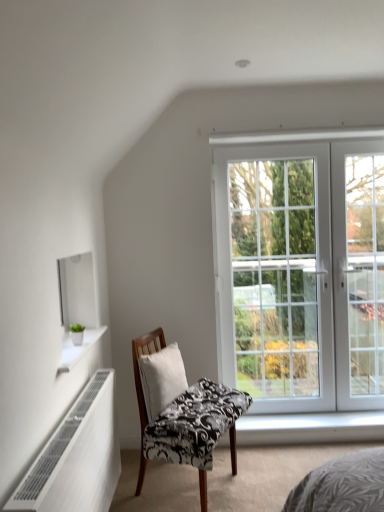
Question: Would you say white glass door at right is part of black and white patterned chair at center's contents?

Choices:
 (A) no
 (B) yes

Answer: (A)

Question: Are black and white patterned chair at center and white glass door at right making contact?

Choices:
 (A) yes
 (B) no

Answer: (B)

Question: Is black and white patterned chair at center wider than white glass door at right?

Choices:
 (A) no
 (B) yes

Answer: (B)

Question: Can you confirm if black and white patterned chair at center is shorter than white glass door at right?

Choices:
 (A) yes
 (B) no

Answer: (A)

Question: Does black and white patterned chair at center appear on the right side of white glass door at right?

Choices:
 (A) yes
 (B) no

Answer: (B)

Question: From the image's perspective, is black and white patterned chair at center on white glass door at right?

Choices:
 (A) no
 (B) yes

Answer: (A)

Question: Would you consider white fabric pillow at center to be distant from white glossy shelf at upper left?

Choices:
 (A) yes
 (B) no

Answer: (B)

Question: Could white glossy shelf at upper left be considered to be inside white fabric pillow at center?

Choices:
 (A) yes
 (B) no

Answer: (B)

Question: Is white fabric pillow at center completely or partially outside of white glossy shelf at upper left?

Choices:
 (A) yes
 (B) no

Answer: (A)

Question: Can you confirm if white fabric pillow at center is bigger than white glossy shelf at upper left?

Choices:
 (A) yes
 (B) no

Answer: (A)

Question: Is white glossy shelf at upper left at the back of white fabric pillow at center?

Choices:
 (A) yes
 (B) no

Answer: (B)

Question: Is white fabric pillow at center next to white glossy shelf at upper left?

Choices:
 (A) no
 (B) yes

Answer: (A)

Question: Is black and white patterned chair at center oriented towards white glass door at right?

Choices:
 (A) yes
 (B) no

Answer: (B)